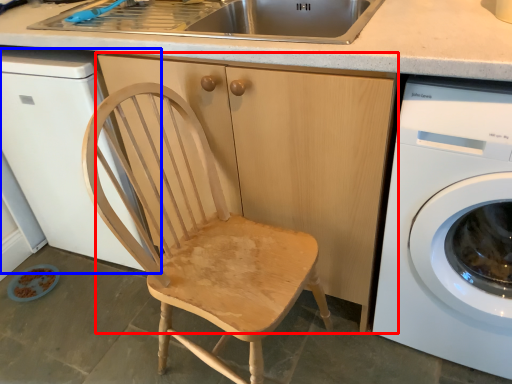
Question: Which of the following is the farthest to the observer, cabinetry (highlighted by a red box) or dish washer (highlighted by a blue box)?

Choices:
 (A) cabinetry
 (B) dish washer

Answer: (B)